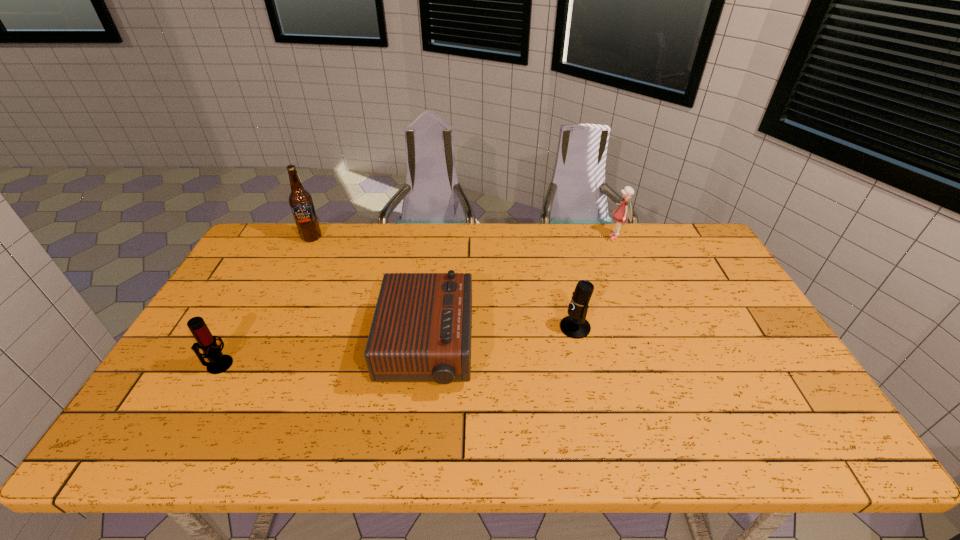
Find the location of `the tallest object`. the tallest object is located at coordinates (301, 203).

You are a GUI agent. You are given a task and a screenshot of the screen. Output one action in this format:
    pyautogui.click(x=<x>, y=<y>)
    Task: Click on the second object from left to right
    
    Given the screenshot: What is the action you would take?
    pyautogui.click(x=301, y=203)

Identify the location of doll. (624, 211).

This screenshot has width=960, height=540. What are the coordinates of `the rightmost object` in the screenshot? It's located at (624, 211).

At what (x,y) coordinates should I click in order to perform the action: click on the leftmost object. Please return your answer as a coordinate pair (x, y). This screenshot has width=960, height=540. Looking at the image, I should click on (218, 363).

At what (x,y) coordinates should I click in order to perform the action: click on the left microphone. Please return your answer as a coordinate pair (x, y). Image resolution: width=960 pixels, height=540 pixels. Looking at the image, I should click on (218, 363).

Where is `the right microphone`? the right microphone is located at coordinates (575, 325).

Find the location of a particular element. This screenshot has width=960, height=540. the farther microphone is located at coordinates (575, 325).

The width and height of the screenshot is (960, 540). In order to click on radio receiver in this screenshot , I will do `click(421, 330)`.

Locate an element on the screen. The image size is (960, 540). free region located on the label of the fourth object from right to left is located at coordinates (277, 308).